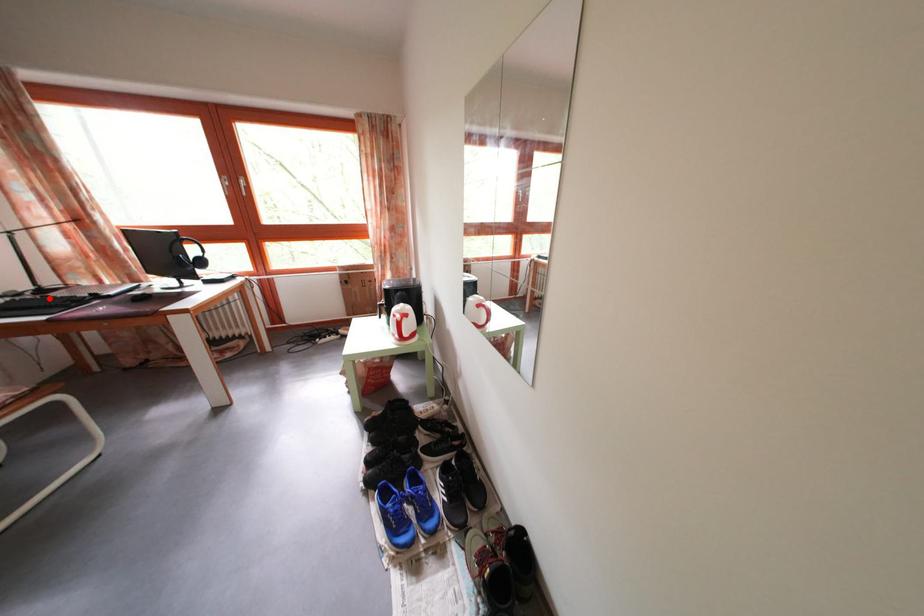
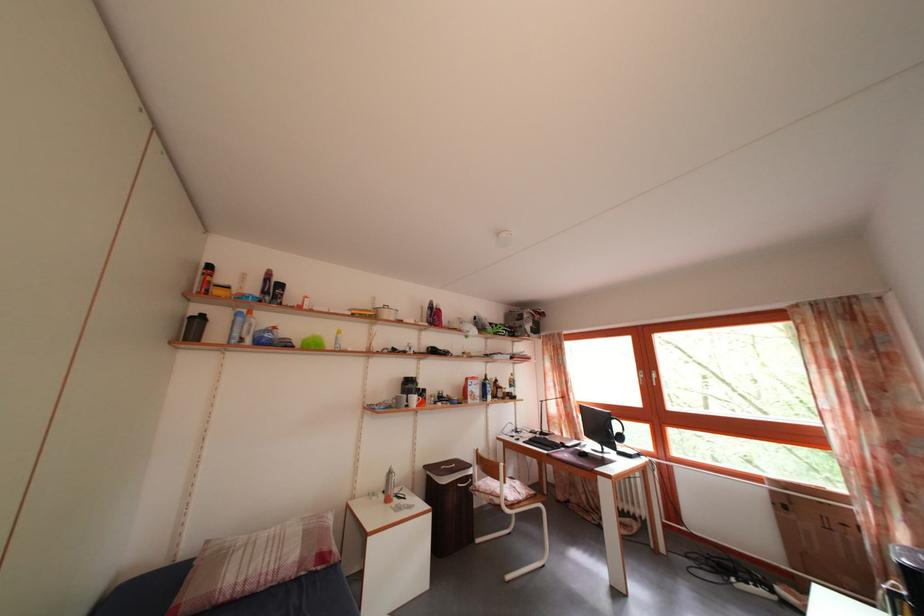
Question: I am providing you with two images of the same scene from different viewpoints. Given a red point in image1, look at the same physical point in image2. Is it:

Choices:
 (A) Closer to the viewpoint
 (B) Farther from the viewpoint

Answer: (B)